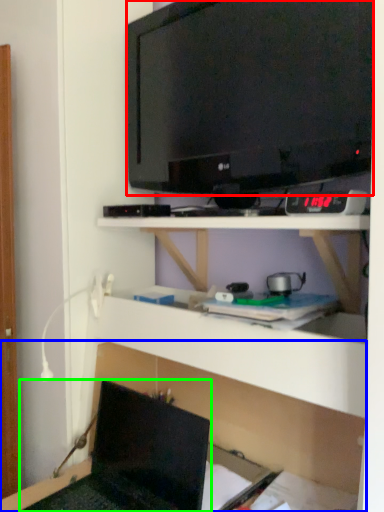
Question: Based on their relative distances, which object is farther from television (highlighted by a red box)? Choose from shelf (highlighted by a blue box) and laptop (highlighted by a green box).

Choices:
 (A) shelf
 (B) laptop

Answer: (B)